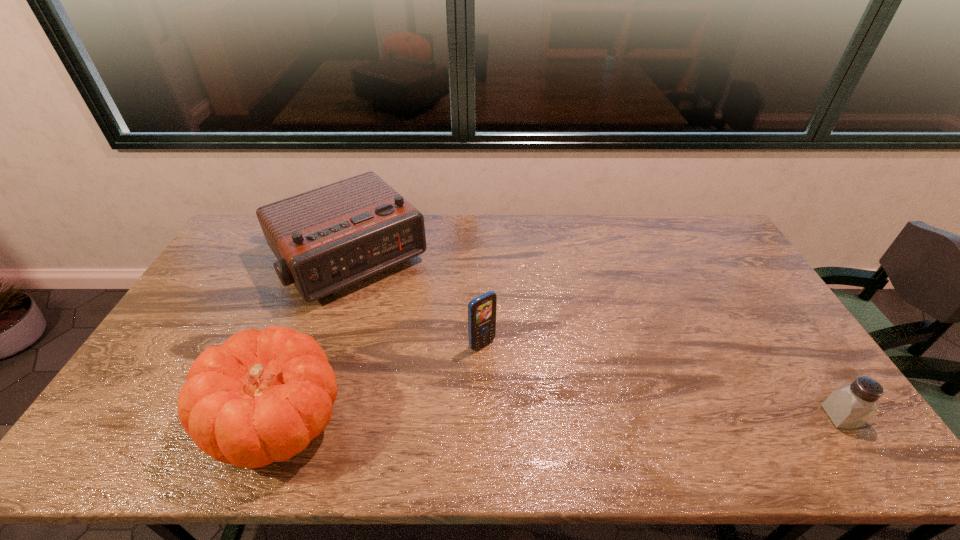
This screenshot has width=960, height=540. I want to click on free area in between the second farthest object and the saltshaker, so click(661, 381).

The image size is (960, 540). In order to click on vacant space in between the saltshaker and the second object from right to left in this screenshot , I will do `click(661, 381)`.

Find the location of a particular element. The width and height of the screenshot is (960, 540). object that ranks as the third closest to the farthest object is located at coordinates (850, 406).

Locate which object ranks second in proximity to the shortest object. Please provide its 2D coordinates. Your answer should be formatted as a tuple, i.e. [(x, y)], where the tuple contains the x and y coordinates of a point satisfying the conditions above.

[(326, 239)]

Find the location of a particular element. Image resolution: width=960 pixels, height=540 pixels. free space that satisfies the following two spatial constraints: 1. on the back side of the farthest object; 2. on the left side of the pumpkin is located at coordinates (339, 259).

Locate an element on the screen. The image size is (960, 540). vacant region that satisfies the following two spatial constraints: 1. on the back side of the third object from left to right; 2. on the left side of the pumpkin is located at coordinates pyautogui.click(x=307, y=345).